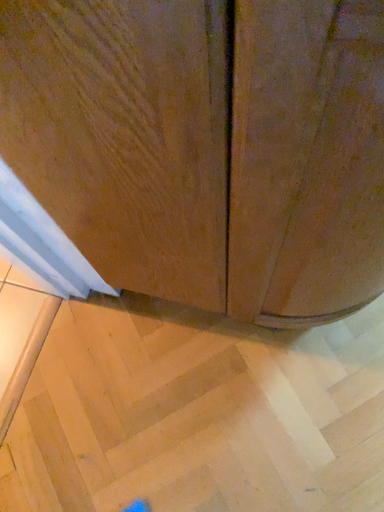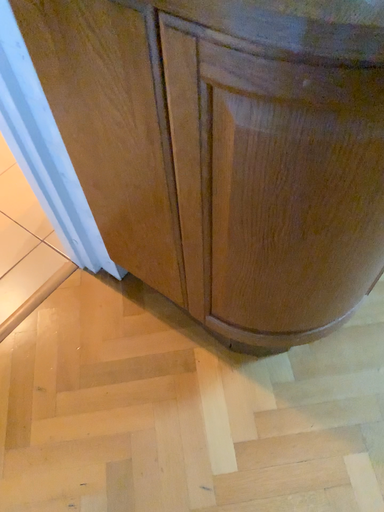
Question: How did the camera likely rotate when shooting the video?

Choices:
 (A) rotated upward
 (B) rotated downward

Answer: (A)